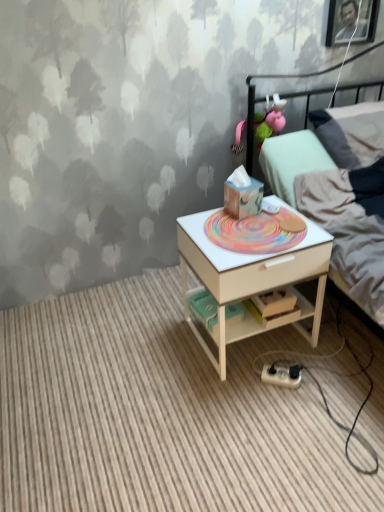
You are a GUI agent. You are given a task and a screenshot of the screen. Output one action in this format:
    pyautogui.click(x=<x>, y=<y>)
    Task: Click on the vacant space to the right of white wood desk at center
    The image size is (384, 512).
    Given the screenshot: What is the action you would take?
    pyautogui.click(x=342, y=348)